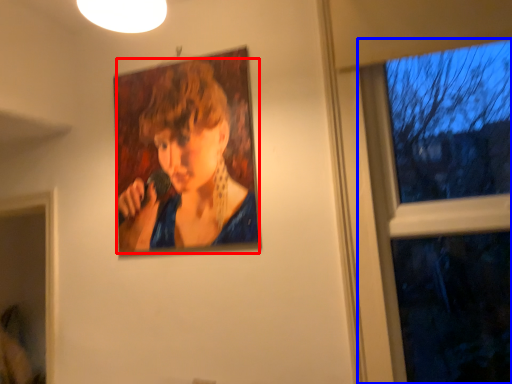
Question: Which of the following is the closest to the observer, person (highlighted by a red box) or window (highlighted by a blue box)?

Choices:
 (A) person
 (B) window

Answer: (B)